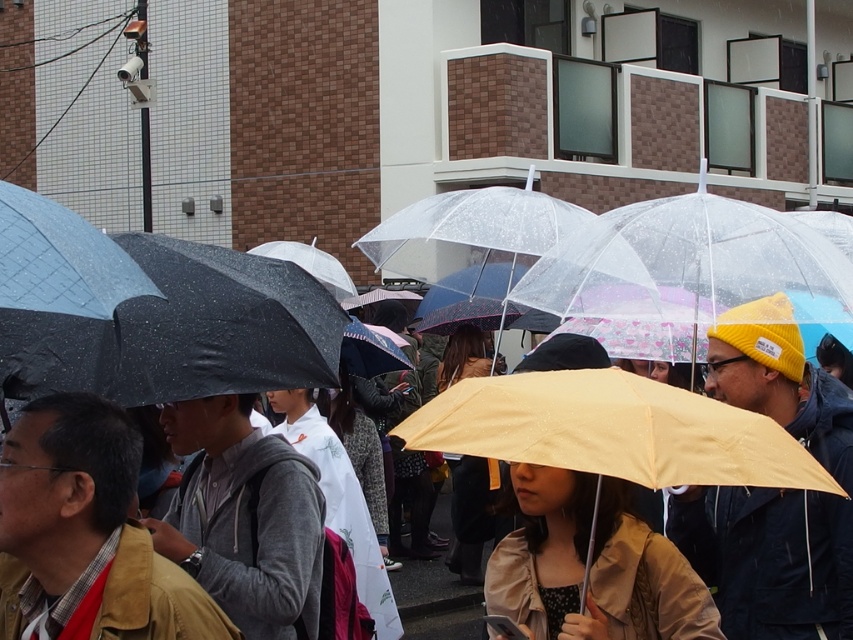
Question: Observing the image, what is the correct spatial positioning of matte brown jacket at lower left in reference to tan fabric jacket at center?

Choices:
 (A) below
 (B) above

Answer: (B)

Question: Can you confirm if matte brown jacket at lower left is positioned below tan fabric jacket at center?

Choices:
 (A) yes
 (B) no

Answer: (B)

Question: Which object is positioned farthest from the gray fleece jacket at center?

Choices:
 (A) matte brown jacket at lower left
 (B) tan fabric jacket at center

Answer: (B)

Question: Among these objects, which one is farthest from the camera?

Choices:
 (A) matte brown jacket at lower left
 (B) gray fleece jacket at center

Answer: (B)

Question: Which of the following is the farthest from the observer?

Choices:
 (A) [x=67, y=570]
 (B) [x=311, y=524]

Answer: (B)

Question: Is matte brown jacket at lower left below tan fabric jacket at center?

Choices:
 (A) yes
 (B) no

Answer: (B)